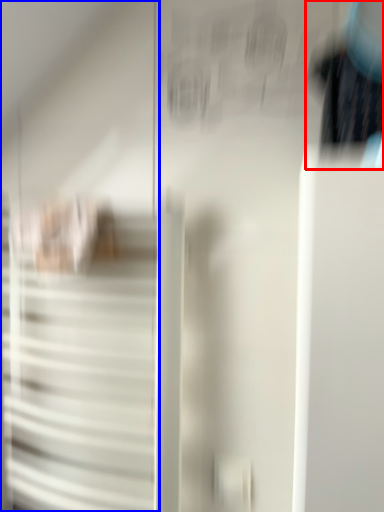
Question: Which point is closer to the camera, couple (highlighted by a red box) or door (highlighted by a blue box)?

Choices:
 (A) couple
 (B) door

Answer: (A)